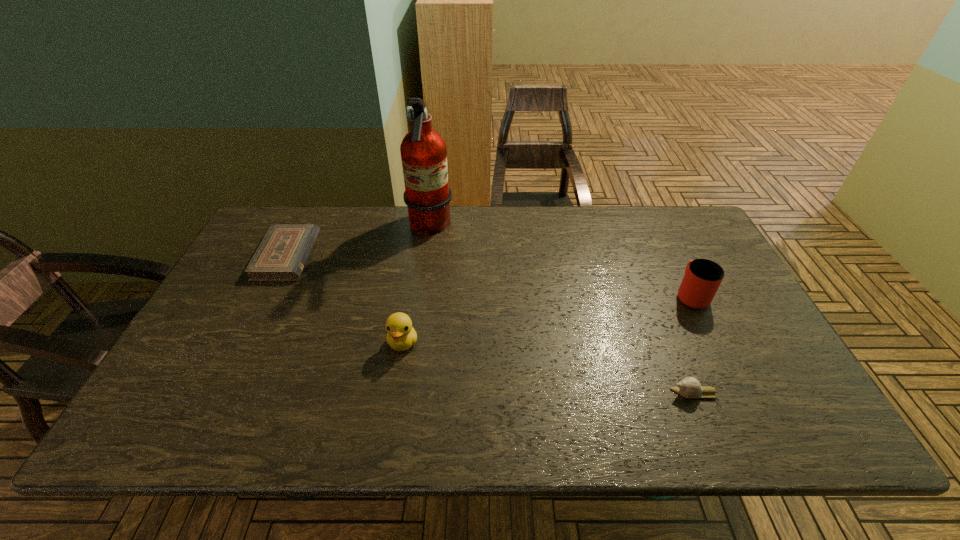
The height and width of the screenshot is (540, 960). What are the coordinates of `free space located 0.270m on the handle side of the rightmost object` in the screenshot? It's located at (656, 224).

In order to click on free space located on the face of the duck in this screenshot , I will do tap(393, 403).

At what (x,y) coordinates should I click in order to perform the action: click on free space located 0.080m on the shell of the second shortest object. Please return your answer as a coordinate pair (x, y). This screenshot has height=540, width=960. Looking at the image, I should click on pyautogui.click(x=636, y=393).

I want to click on free space located 0.160m on the shell of the second shortest object, so click(601, 393).

Where is `free space located 0.400m on the shell of the second shortest object`? The image size is (960, 540). free space located 0.400m on the shell of the second shortest object is located at coordinates (494, 393).

The width and height of the screenshot is (960, 540). I want to click on vacant space located 0.210m on the spine side of the leftmost object, so point(380,255).

At what (x,y) coordinates should I click in order to perform the action: click on fire extinguisher present at the far edge. Please return your answer as a coordinate pair (x, y). Image resolution: width=960 pixels, height=540 pixels. Looking at the image, I should click on (427, 195).

I want to click on Bible at the far edge, so click(281, 256).

Find the location of a particular element. Image resolution: width=960 pixels, height=540 pixels. object positioned at the left edge is located at coordinates (281, 256).

You are a GUI agent. You are given a task and a screenshot of the screen. Output one action in this format:
    pyautogui.click(x=<x>, y=<y>)
    Task: Click on the object at the right edge
    The width and height of the screenshot is (960, 540).
    Given the screenshot: What is the action you would take?
    pyautogui.click(x=702, y=278)